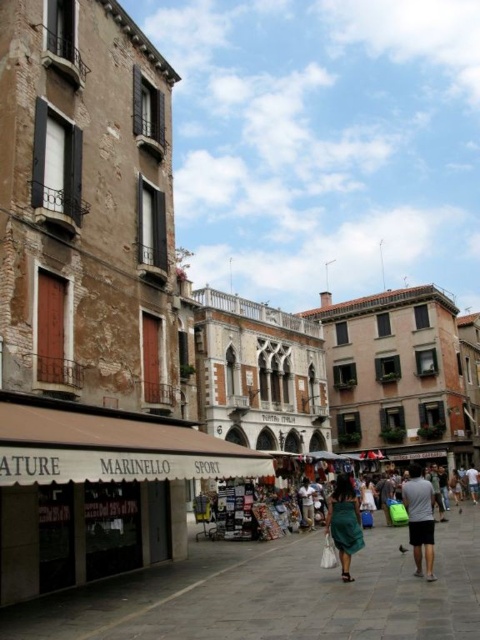
You are a tourist standing on the cobblestone street in front of the ornate building with arched windows. You see the brown fabric awning at center and the green fabric dress at center. Can you walk directly from one to the other without moving sideways?

The brown fabric awning at center and green fabric dress at center are 22.21 meters apart, so yes, you can walk directly from one to the other without moving sideways since the distance is straight and there are no obstacles mentioned in the scene.

You are a tourist standing on the cobblestone street in front of the ornate building with arched windows. You notice two items at the center of the building facade. One is the brown fabric awning at center and the other is the green fabric skirt at center. Which one is positioned higher up on the building?

The brown fabric awning at center is above the green fabric skirt at center, so the brown fabric awning at center is positioned higher up on the building.

You are a photographer standing in the historic town square. You want to take a photo that includes both the gray cotton shirt at center and the green fabric dress at center. Given that your camera has a maximum focus range of 15 meters, will you be able to capture both subjects in sharp focus?

The gray cotton shirt at center and green fabric dress at center are 17.02 meters apart from each other, which exceeds the camera maximum focus range of 15 meters. Therefore, you will not be able to capture both subjects in sharp focus.